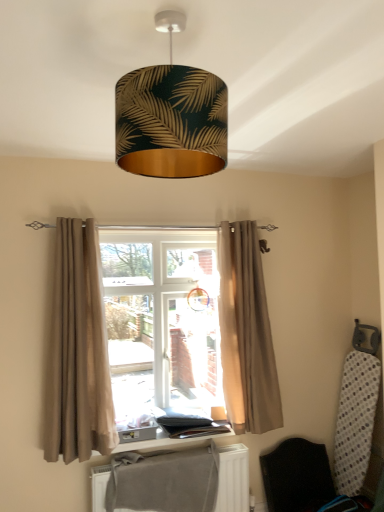
Question: From a real-world perspective, is wooden window sill at center located higher than beige fabric curtain at center?

Choices:
 (A) yes
 (B) no

Answer: (B)

Question: Is beige fabric curtain at center at the back of wooden window sill at center?

Choices:
 (A) no
 (B) yes

Answer: (B)

Question: Is beige fabric curtain at center surrounded by wooden window sill at center?

Choices:
 (A) no
 (B) yes

Answer: (A)

Question: Does wooden window sill at center have a lesser height compared to beige fabric curtain at center?

Choices:
 (A) yes
 (B) no

Answer: (A)

Question: From the image's perspective, does wooden window sill at center appear higher than beige fabric curtain at center?

Choices:
 (A) no
 (B) yes

Answer: (A)

Question: Looking at the image, does gray fabric at lower center seem bigger or smaller compared to beige fabric curtain at center?

Choices:
 (A) small
 (B) big

Answer: (A)

Question: Considering their positions, is gray fabric at lower center located in front of or behind beige fabric curtain at center?

Choices:
 (A) front
 (B) behind

Answer: (A)

Question: Considering the relative positions of gray fabric at lower center and beige fabric curtain at center in the image provided, is gray fabric at lower center to the left or to the right of beige fabric curtain at center?

Choices:
 (A) right
 (B) left

Answer: (A)

Question: Choose the correct answer: Is gray fabric at lower center inside beige fabric curtain at center or outside it?

Choices:
 (A) inside
 (B) outside

Answer: (B)

Question: In terms of height, does black fabric folding chair at lower right look taller or shorter compared to beige fabric curtain at center, which is the 1th curtain in right-to-left order?

Choices:
 (A) short
 (B) tall

Answer: (A)

Question: Considering the positions of black fabric folding chair at lower right and beige fabric curtain at center, which appears as the second curtain when viewed from the left, in the image, is black fabric folding chair at lower right bigger or smaller than beige fabric curtain at center, which appears as the second curtain when viewed from the left,?

Choices:
 (A) small
 (B) big

Answer: (A)

Question: From the image's perspective, is black fabric folding chair at lower right located above or below beige fabric curtain at center, which appears as the second curtain when viewed from the left?

Choices:
 (A) below
 (B) above

Answer: (A)

Question: From a real-world perspective, relative to beige fabric curtain at center, which is the 1th curtain in right-to-left order, is black fabric folding chair at lower right vertically above or below?

Choices:
 (A) above
 (B) below

Answer: (B)

Question: In terms of height, does beige fabric curtain at center, which appears as the second curtain when viewed from the left, look taller or shorter compared to gray fabric at lower center?

Choices:
 (A) tall
 (B) short

Answer: (A)

Question: Considering their positions, is beige fabric curtain at center, which is the 1th curtain in right-to-left order, located in front of or behind gray fabric at lower center?

Choices:
 (A) behind
 (B) front

Answer: (A)